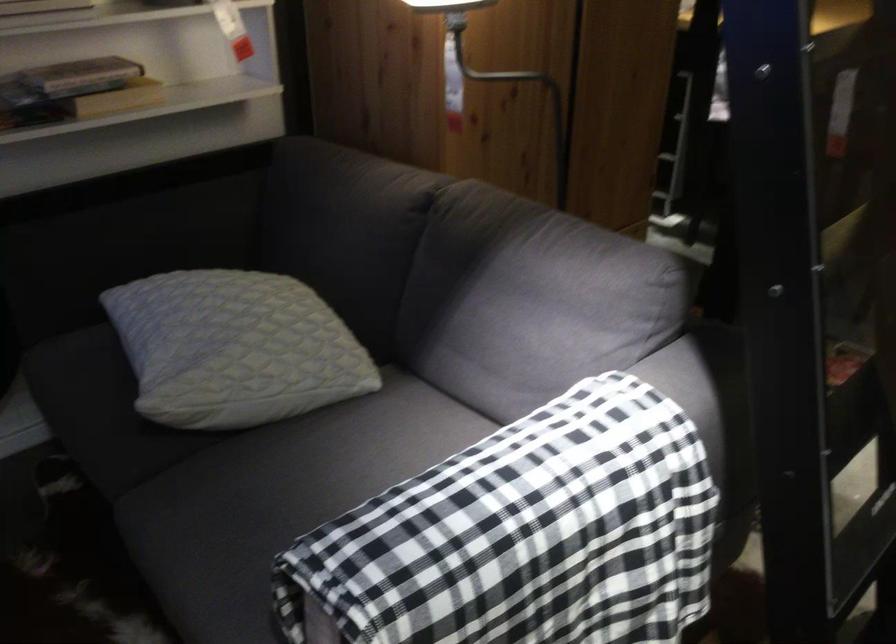
The image size is (896, 644). What are the coordinates of `sofa sitting surface` in the screenshot? It's located at (131, 448).